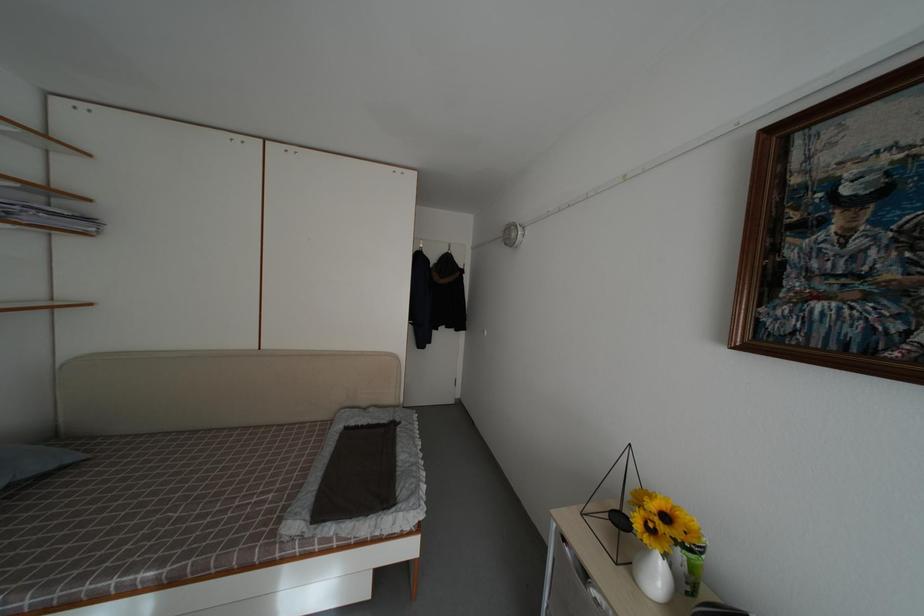
Find the location of a particular element. The image size is (924, 616). bed sitting surface is located at coordinates (188, 487).